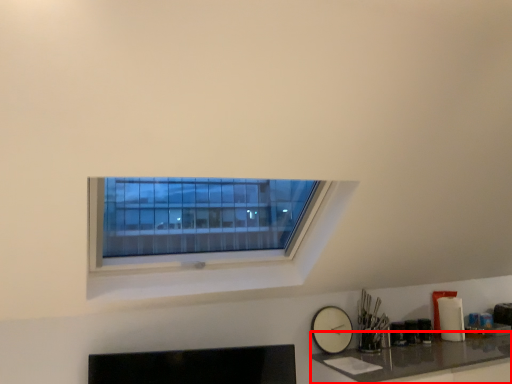
Question: From the image's perspective, what is the correct spatial relationship of counter top (annotated by the red box) in relation to clock?

Choices:
 (A) above
 (B) below

Answer: (B)